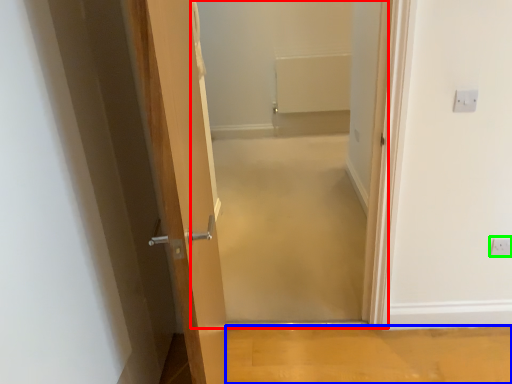
Question: Considering the real-world distances, which object is farthest from corridor (highlighted by a red box)? plain (highlighted by a blue box) or electric outlet (highlighted by a green box)?

Choices:
 (A) plain
 (B) electric outlet

Answer: (B)